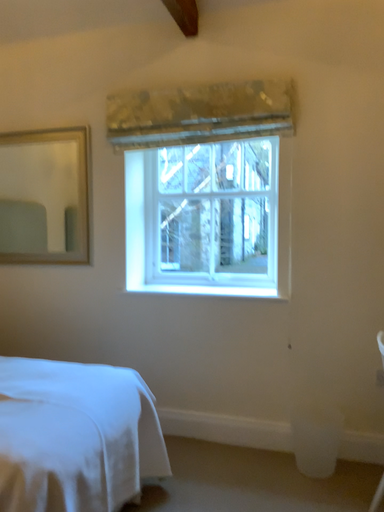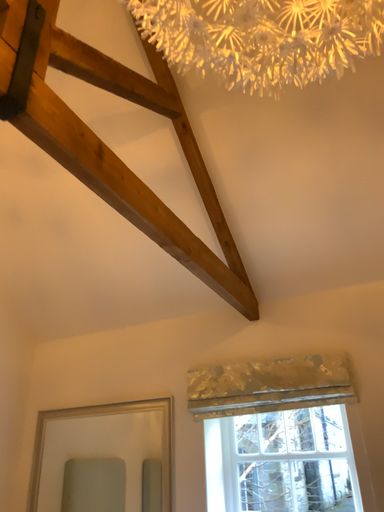
Question: Which way did the camera rotate in the video?

Choices:
 (A) rotated right
 (B) rotated left

Answer: (B)